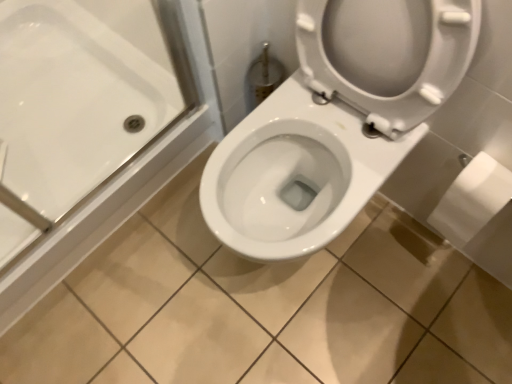
Question: From the image's perspective, is white matte toilet paper at right over white glossy toilet at center?

Choices:
 (A) yes
 (B) no

Answer: (B)

Question: Does white matte toilet paper at right have a greater width compared to white glossy toilet at center?

Choices:
 (A) no
 (B) yes

Answer: (A)

Question: Is white matte toilet paper at right positioned far away from white glossy toilet at center?

Choices:
 (A) yes
 (B) no

Answer: (B)

Question: From the image's perspective, would you say white matte toilet paper at right is shown under white glossy toilet at center?

Choices:
 (A) no
 (B) yes

Answer: (B)

Question: Is white matte toilet paper at right in contact with white glossy toilet at center?

Choices:
 (A) no
 (B) yes

Answer: (A)

Question: From a real-world perspective, is white matte toilet paper at right positioned over white glossy toilet at center based on gravity?

Choices:
 (A) no
 (B) yes

Answer: (A)

Question: Is white glossy toilet at center bigger than white glossy bathtub at upper left?

Choices:
 (A) no
 (B) yes

Answer: (B)

Question: Is white glossy toilet at center outside of white glossy bathtub at upper left?

Choices:
 (A) no
 (B) yes

Answer: (B)

Question: Is white glossy toilet at center to the left of white glossy bathtub at upper left from the viewer's perspective?

Choices:
 (A) no
 (B) yes

Answer: (A)

Question: Can you confirm if white glossy toilet at center is shorter than white glossy bathtub at upper left?

Choices:
 (A) no
 (B) yes

Answer: (A)

Question: Can you confirm if white glossy toilet at center is taller than white glossy bathtub at upper left?

Choices:
 (A) no
 (B) yes

Answer: (B)

Question: From the image's perspective, does white glossy toilet at center appear lower than white glossy bathtub at upper left?

Choices:
 (A) yes
 (B) no

Answer: (A)

Question: From a real-world perspective, is white matte toilet paper at right on top of white glossy bathtub at upper left?

Choices:
 (A) yes
 (B) no

Answer: (B)